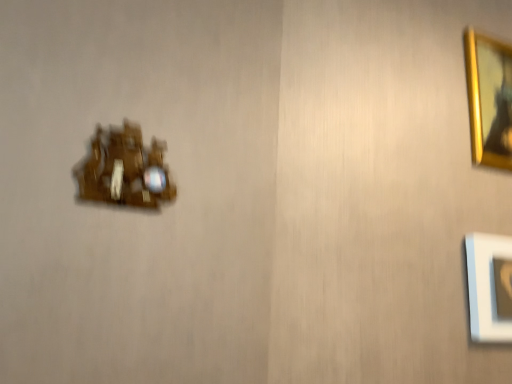
Question: In the image, is gold metallic picture frame at upper right on the left side or the right side of wooden clock at left?

Choices:
 (A) left
 (B) right

Answer: (B)

Question: Looking at their shapes, would you say gold metallic picture frame at upper right is wider or thinner than wooden clock at left?

Choices:
 (A) wide
 (B) thin

Answer: (A)

Question: From their relative heights in the image, would you say gold metallic picture frame at upper right is taller or shorter than wooden clock at left?

Choices:
 (A) short
 (B) tall

Answer: (B)

Question: Based on their sizes in the image, would you say wooden clock at left is bigger or smaller than gold metallic picture frame at upper right?

Choices:
 (A) big
 (B) small

Answer: (B)

Question: In the image, is wooden clock at left on the left side or the right side of gold metallic picture frame at upper right?

Choices:
 (A) left
 (B) right

Answer: (A)

Question: In terms of height, does wooden clock at left look taller or shorter compared to gold metallic picture frame at upper right?

Choices:
 (A) short
 (B) tall

Answer: (A)

Question: Considering their positions, is wooden clock at left located in front of or behind gold metallic picture frame at upper right?

Choices:
 (A) front
 (B) behind

Answer: (A)